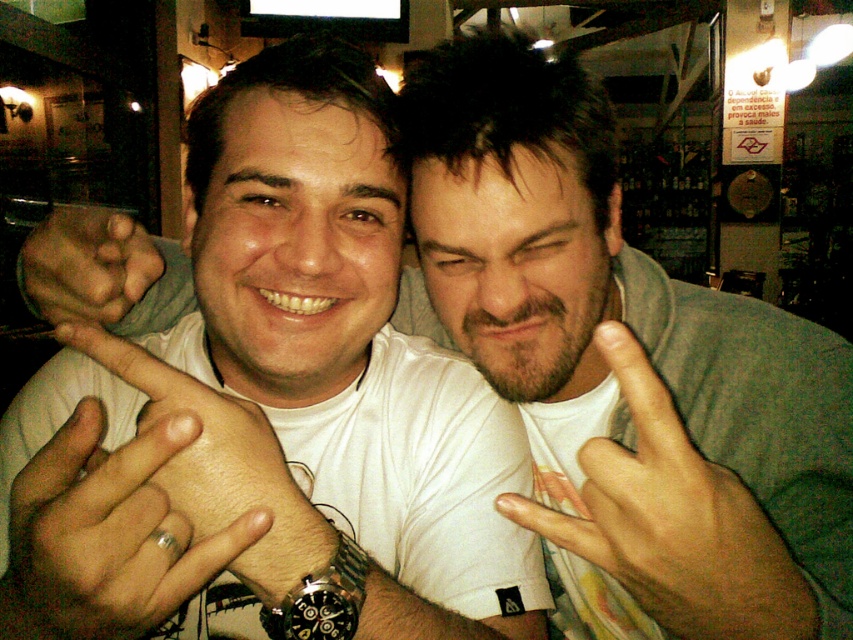
Can you confirm if beige fabric hand at center is taller than black metallic watch at center?

Yes.

Is the position of beige fabric hand at center less distant than that of black metallic watch at center?

Yes, beige fabric hand at center is closer to the viewer.

Between point (732, 608) and point (289, 628), which one is positioned in front?

Positioned in front is point (732, 608).

At what (x,y) coordinates should I click in order to perform the action: click on beige fabric hand at center. Please return your answer as a coordinate pair (x, y). Looking at the image, I should click on (674, 520).

Does point (62, 317) come closer to viewer compared to point (352, 586)?

No, (62, 317) is behind (352, 586).

Does point (91, 220) come behind point (351, 624)?

Yes, it is behind point (351, 624).

Where is `matte skin hand at center`? The height and width of the screenshot is (640, 853). matte skin hand at center is located at coordinates (86, 264).

Does silver metallic ring at lower left appear on the right side of matte skin hand at center?

Yes, silver metallic ring at lower left is to the right of matte skin hand at center.

Can you confirm if silver metallic ring at lower left is shorter than matte skin hand at center?

No, silver metallic ring at lower left is not shorter than matte skin hand at center.

The height and width of the screenshot is (640, 853). Describe the element at coordinates (105, 536) in the screenshot. I see `silver metallic ring at lower left` at that location.

In order to click on silver metallic ring at lower left in this screenshot , I will do `click(105, 536)`.